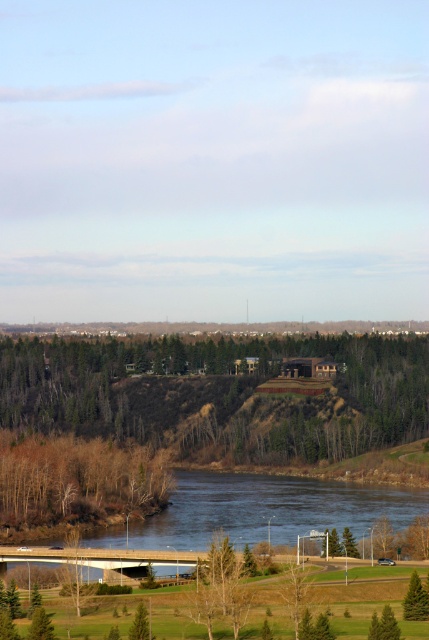
Which is behind, point (204, 356) or point (68, 612)?

Positioned behind is point (204, 356).

Can you confirm if green leafy tree at center is positioned above green grassy field at lower center?

Yes.

Does point (145, 355) come behind point (341, 557)?

That is True.

Locate an element on the screen. The height and width of the screenshot is (640, 429). green leafy tree at center is located at coordinates (215, 394).

Which is more to the right, green grassy field at lower center or green matte tree at lower right?

green matte tree at lower right is more to the right.

Can you confirm if green grassy field at lower center is positioned below green matte tree at lower right?

Yes.

Is point (27, 552) in front of point (410, 620)?

No.

Where is `green grassy field at lower center`? The height and width of the screenshot is (640, 429). green grassy field at lower center is located at coordinates (265, 600).

Is brown/rocky river at lower center further to camera compared to green matte tree at lower center?

That is True.

Which is behind, point (271, 502) or point (138, 625)?

The point (271, 502) is behind.

Is point (269, 476) positioned after point (138, 630)?

Yes, point (269, 476) is farther from viewer.

Where is `brown/rocky river at lower center`? Image resolution: width=429 pixels, height=640 pixels. brown/rocky river at lower center is located at coordinates (269, 508).